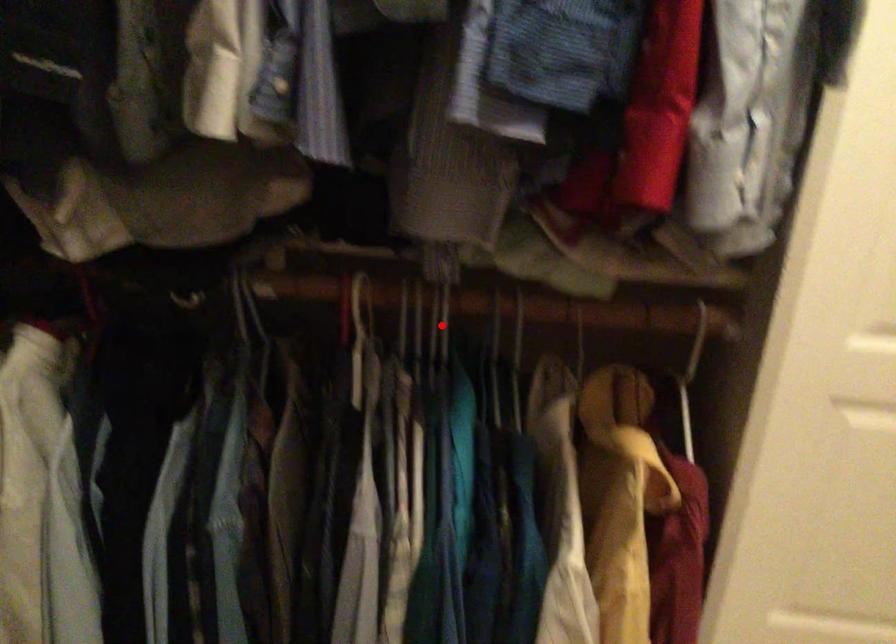
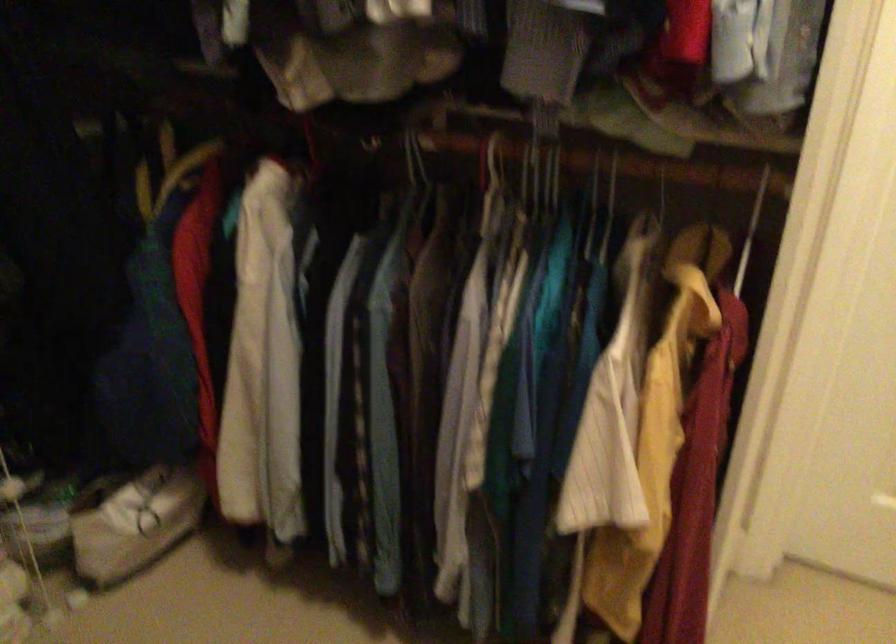
Question: A red point is marked in image1. In image2, is the corresponding 3D point closer to the camera or farther? Reply with the corresponding letter.

Choices:
 (A) The corresponding 3D point is closer.
 (B) The corresponding 3D point is farther.

Answer: (B)